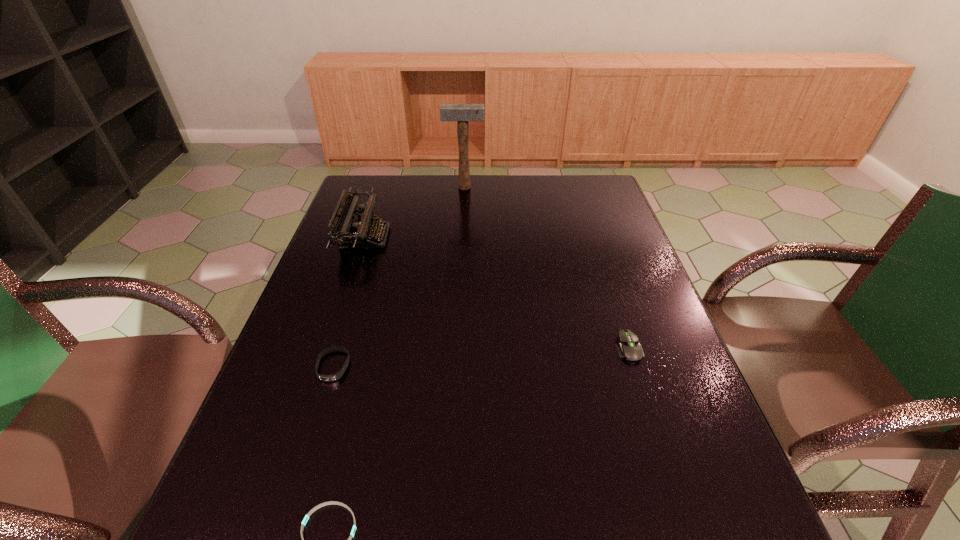
Find the location of a particular element. The width and height of the screenshot is (960, 540). mallet that is at the far edge is located at coordinates (462, 113).

You are a GUI agent. You are given a task and a screenshot of the screen. Output one action in this format:
    pyautogui.click(x=<x>, y=<y>)
    Task: Click on the typewriter that is at the far edge
    Image resolution: width=960 pixels, height=540 pixels.
    Given the screenshot: What is the action you would take?
    pyautogui.click(x=348, y=230)

Identify the location of typewriter that is at the left edge. Image resolution: width=960 pixels, height=540 pixels. (348, 230).

Find the location of a particular element. The height and width of the screenshot is (540, 960). wristband that is at the left edge is located at coordinates (327, 378).

Where is `object located at the right edge`? The image size is (960, 540). object located at the right edge is located at coordinates (629, 347).

The height and width of the screenshot is (540, 960). I want to click on object present at the far left corner, so click(x=348, y=230).

This screenshot has width=960, height=540. In order to click on vacant space at the far edge in this screenshot , I will do tap(439, 185).

The height and width of the screenshot is (540, 960). What are the coordinates of `vacant space at the left edge` in the screenshot? It's located at (322, 435).

Locate an element on the screen. The width and height of the screenshot is (960, 540). vacant space at the right edge of the desktop is located at coordinates (613, 237).

At what (x,y) coordinates should I click in order to perform the action: click on vacant position at the far left corner of the desktop. Please return your answer as a coordinate pair (x, y). The width and height of the screenshot is (960, 540). Looking at the image, I should click on (391, 194).